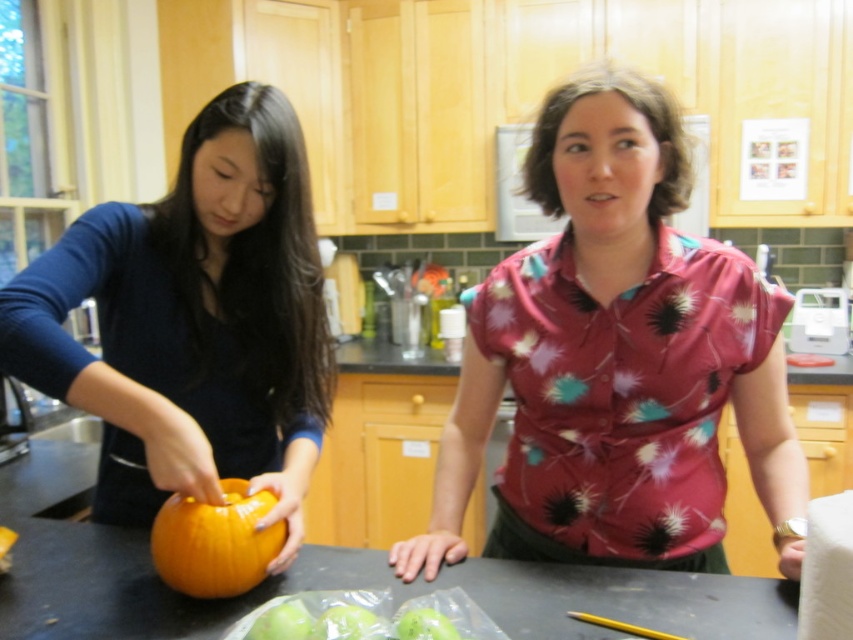
You are a chef preparing a fruit platter and need to place the green matte apple at lower center and the green matte apple at center on a rectangular plate. The plate is 12 centimeters wide. Can both apples fit side by side on the plate without overlapping?

The distance between the green matte apple at lower center and green matte apple at center is 11.04 centimeters, which is less than the plate width of 12 centimeters. Therefore, both apples can fit side by side on the plate without overlapping.

You are trying to decide which pumpkin to use for carving. The smooth orange pumpkin at center and the orange matte pumpkin at center are both on the countertop. Which one is smaller in height?

The smooth orange pumpkin at center is shorter than the orange matte pumpkin at center, so it is smaller in height.